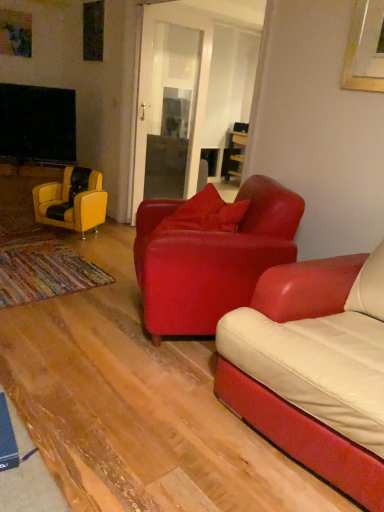
Identify the location of leather yellow armchair at left, which is the 1th chair in back-to-front order. Image resolution: width=384 pixels, height=512 pixels. (72, 201).

Measure the distance between point (80, 194) and camera.

They are 3.61 meters apart.

Describe the element at coordinates (72, 201) in the screenshot. I see `leather yellow armchair at left, arranged as the 2th chair when viewed from the right` at that location.

Measure the distance between point (199, 302) and camera.

Point (199, 302) is 2.17 meters away from camera.

This screenshot has height=512, width=384. What are the coordinates of `satin red armchair at center, arranged as the second chair when viewed from the left` in the screenshot? It's located at (211, 259).

This screenshot has width=384, height=512. What do you see at coordinates (211, 259) in the screenshot? I see `satin red armchair at center, acting as the 2th chair starting from the back` at bounding box center [211, 259].

Identify the location of leather yellow armchair at left, which is the second chair from front to back. (72, 201).

Which object is positioned more to the left, satin red armchair at center, arranged as the second chair when viewed from the left, or leather yellow armchair at left, which is the first chair from left to right?

From the viewer's perspective, leather yellow armchair at left, which is the first chair from left to right, appears more on the left side.

Between satin red armchair at center, acting as the 2th chair starting from the back, and leather yellow armchair at left, which is the first chair from left to right, which one is positioned behind?

leather yellow armchair at left, which is the first chair from left to right, is more distant.

Which is closer to the camera, (x=284, y=255) or (x=82, y=229)?

Point (x=284, y=255) is positioned closer to the camera compared to point (x=82, y=229).

From the image's perspective, which one is positioned higher, satin red armchair at center, which is the first chair in front-to-back order, or leather yellow armchair at left, which is the first chair from left to right?

leather yellow armchair at left, which is the first chair from left to right, is shown above in the image.

From a real-world perspective, does satin red armchair at center, the first chair when ordered from right to left, stand above leather yellow armchair at left, which is the second chair from front to back?

Yes.

Which object is thinner, satin red armchair at center, acting as the 2th chair starting from the back, or leather yellow armchair at left, which is the 1th chair in back-to-front order?

Thinner between the two is leather yellow armchair at left, which is the 1th chair in back-to-front order.

Is satin red armchair at center, arranged as the second chair when viewed from the left, taller or shorter than leather yellow armchair at left, which is the second chair from front to back?

Considering their sizes, satin red armchair at center, arranged as the second chair when viewed from the left, has more height than leather yellow armchair at left, which is the second chair from front to back.

Does satin red armchair at center, the first chair when ordered from right to left, have a smaller size compared to leather yellow armchair at left, arranged as the 2th chair when viewed from the right?

Incorrect, satin red armchair at center, the first chair when ordered from right to left, is not smaller in size than leather yellow armchair at left, arranged as the 2th chair when viewed from the right.

Is satin red armchair at center, arranged as the second chair when viewed from the left, completely or partially outside of leather yellow armchair at left, which is the first chair from left to right?

satin red armchair at center, arranged as the second chair when viewed from the left, lies outside leather yellow armchair at left, which is the first chair from left to right,'s area.

Are satin red armchair at center, arranged as the second chair when viewed from the left, and leather yellow armchair at left, which is the first chair from left to right, making contact?

No.

Is satin red armchair at center, arranged as the second chair when viewed from the left, positioned with its back to leather yellow armchair at left, arranged as the 2th chair when viewed from the right?

No, satin red armchair at center, arranged as the second chair when viewed from the left, is not facing away from leather yellow armchair at left, arranged as the 2th chair when viewed from the right.

Locate an element on the screen. chair above the leather yellow armchair at left, which is the second chair from front to back (from a real-world perspective) is located at coordinates (211, 259).

Does leather yellow armchair at left, which is the second chair from front to back, appear on the left side of satin red armchair at center, arranged as the second chair when viewed from the left?

Indeed, leather yellow armchair at left, which is the second chair from front to back, is positioned on the left side of satin red armchair at center, arranged as the second chair when viewed from the left.

Based on the photo, in the image, is leather yellow armchair at left, which is the 1th chair in back-to-front order, positioned in front of or behind satin red armchair at center, which is the first chair in front-to-back order?

leather yellow armchair at left, which is the 1th chair in back-to-front order, is positioned farther from the viewer than satin red armchair at center, which is the first chair in front-to-back order.

Which is in front, point (65, 168) or point (173, 204)?

Point (173, 204)

Looking at this image, from the image's perspective, which one is positioned lower, leather yellow armchair at left, which is the first chair from left to right, or satin red armchair at center, which is the first chair in front-to-back order?

satin red armchair at center, which is the first chair in front-to-back order, from the image's perspective.

From a real-world perspective, between leather yellow armchair at left, which is the first chair from left to right, and satin red armchair at center, arranged as the second chair when viewed from the left, who is vertically higher?

satin red armchair at center, arranged as the second chair when viewed from the left, is physically above.

Does leather yellow armchair at left, which is the first chair from left to right, have a greater width compared to satin red armchair at center, acting as the 2th chair starting from the back?

No.

Consider the image. Who is taller, leather yellow armchair at left, which is the first chair from left to right, or satin red armchair at center, acting as the 2th chair starting from the back?

satin red armchair at center, acting as the 2th chair starting from the back, is taller.

Can you confirm if leather yellow armchair at left, which is the 1th chair in back-to-front order, is smaller than satin red armchair at center, the first chair when ordered from right to left?

Yes, leather yellow armchair at left, which is the 1th chair in back-to-front order, is smaller than satin red armchair at center, the first chair when ordered from right to left.

Can we say leather yellow armchair at left, which is the second chair from front to back, lies outside satin red armchair at center, arranged as the second chair when viewed from the left?

That's correct, leather yellow armchair at left, which is the second chair from front to back, is outside of satin red armchair at center, arranged as the second chair when viewed from the left.

Is leather yellow armchair at left, which is the first chair from left to right, placed right next to satin red armchair at center, acting as the 2th chair starting from the back?

No, leather yellow armchair at left, which is the first chair from left to right, is not next to satin red armchair at center, acting as the 2th chair starting from the back.

Is leather yellow armchair at left, which is the 1th chair in back-to-front order, positioned with its back to satin red armchair at center, acting as the 2th chair starting from the back?

No, leather yellow armchair at left, which is the 1th chair in back-to-front order, is not facing away from satin red armchair at center, acting as the 2th chair starting from the back.

How many degrees apart are the facing directions of leather yellow armchair at left, arranged as the 2th chair when viewed from the right, and satin red armchair at center, acting as the 2th chair starting from the back?

The angle between the facing direction of leather yellow armchair at left, arranged as the 2th chair when viewed from the right, and the facing direction of satin red armchair at center, acting as the 2th chair starting from the back, is 61.4 degrees.

How distant is leather yellow armchair at left, which is the 1th chair in back-to-front order, from satin red armchair at center, arranged as the second chair when viewed from the left?

leather yellow armchair at left, which is the 1th chair in back-to-front order, and satin red armchair at center, arranged as the second chair when viewed from the left, are 5.09 feet apart.

Find the location of a particular element. chair that appears above the satin red armchair at center, arranged as the second chair when viewed from the left (from the image's perspective) is located at coordinates (72, 201).

The image size is (384, 512). I want to click on chair to the left of satin red armchair at center, arranged as the second chair when viewed from the left, so click(x=72, y=201).

Locate an element on the screen. This screenshot has width=384, height=512. chair on the right side of leather yellow armchair at left, which is the 1th chair in back-to-front order is located at coordinates (211, 259).